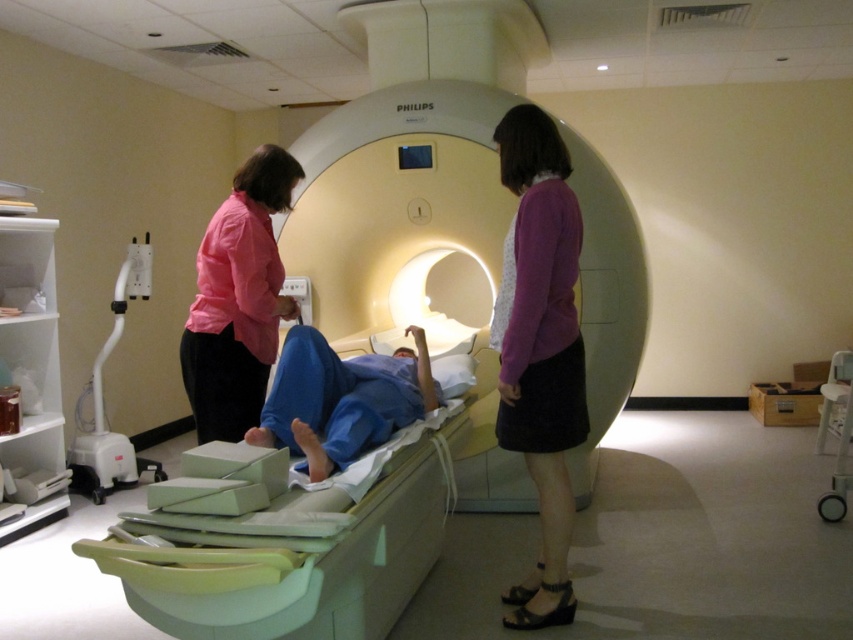
Question: Which point is closer to the camera taking this photo?

Choices:
 (A) (846, 448)
 (B) (503, 314)
 (C) (100, 490)
 (D) (202, 360)

Answer: (B)

Question: Which object is the farthest from the white plastic oxygen tank at left?

Choices:
 (A) white plastic cart at lower right
 (B) blue fabric at center
 (C) purple fabric skirt at center

Answer: (A)

Question: Considering the relative positions of purple fabric skirt at center and white plastic oxygen tank at left in the image provided, where is purple fabric skirt at center located with respect to white plastic oxygen tank at left?

Choices:
 (A) below
 (B) above

Answer: (B)

Question: Which is nearer to the purple fabric skirt at center?

Choices:
 (A) white plastic oxygen tank at left
 (B) light green plastic hospital bed at center

Answer: (B)

Question: Is white plastic oxygen tank at left closer to camera compared to white plastic cart at lower right?

Choices:
 (A) no
 (B) yes

Answer: (A)

Question: Can you confirm if light green plastic hospital bed at center is positioned above pink fabric shirt at left?

Choices:
 (A) no
 (B) yes

Answer: (A)